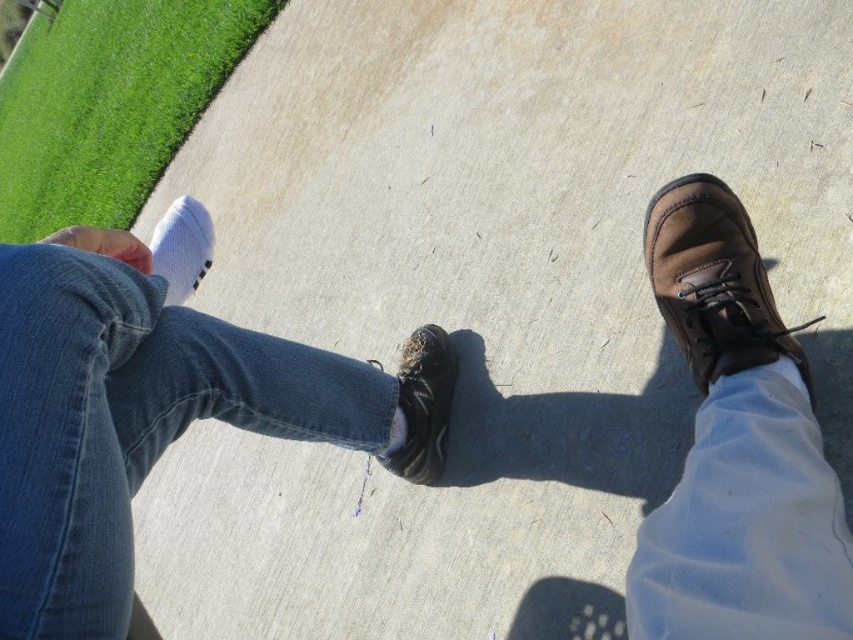
You are a photographer trying to capture a photo of both the brown suede boot at right and the white soft sock at lower left. Since you want to focus on the closer object, which one should you adjust your camera to focus on?

The brown suede boot at right is closer to the viewer than the white soft sock at lower left, so you should adjust your camera to focus on the brown suede boot at right.

You are a photographer trying to capture the height difference between the brown suede boot at right and the white soft sock at lower left. Which object should you focus on to highlight the height difference?

The brown suede boot at right has a greater height compared to the white soft sock at lower left, so focusing on the brown suede boot at right would best highlight the height difference between the two objects.

You are a photographer trying to capture a photo of the denim at left and the brown suede boot at right. Based on their positions, which one should you focus on first if you want to ensure both are in the frame without moving the camera?

Since denim at left is to the left of brown suede boot at right, you should focus on denim at left first to ensure both are in the frame without moving the camera.